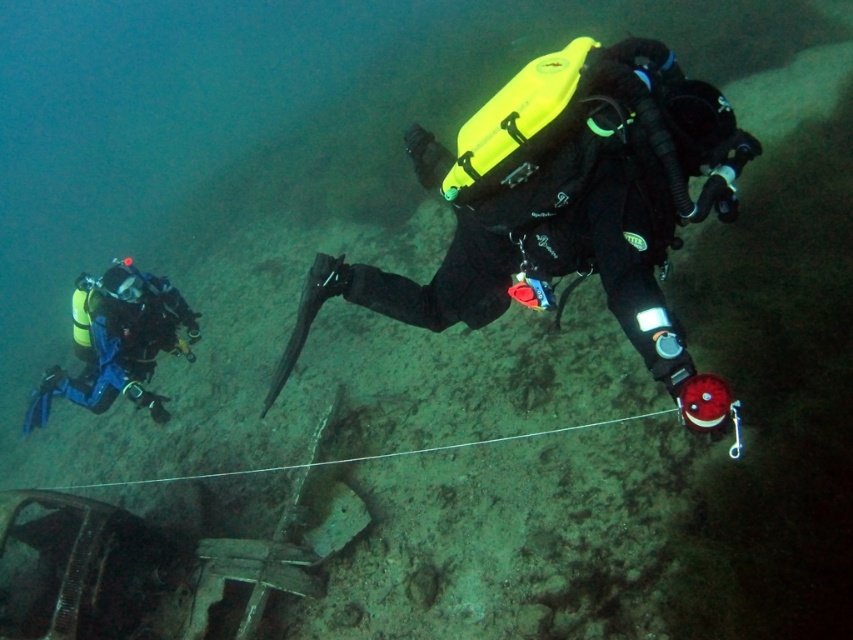
Question: Can you confirm if matte black diving suit at center is positioned above blue matte scuba diver at left?

Choices:
 (A) yes
 (B) no

Answer: (A)

Question: Which point is farther to the camera?

Choices:
 (A) matte black diving suit at center
 (B) blue matte scuba diver at left

Answer: (B)

Question: Which point appears closest to the camera in this image?

Choices:
 (A) (474, 148)
 (B) (146, 326)

Answer: (A)

Question: Is matte black diving suit at center further to the viewer compared to blue matte scuba diver at left?

Choices:
 (A) no
 (B) yes

Answer: (A)

Question: Where is matte black diving suit at center located in relation to blue matte scuba diver at left in the image?

Choices:
 (A) right
 (B) left

Answer: (A)